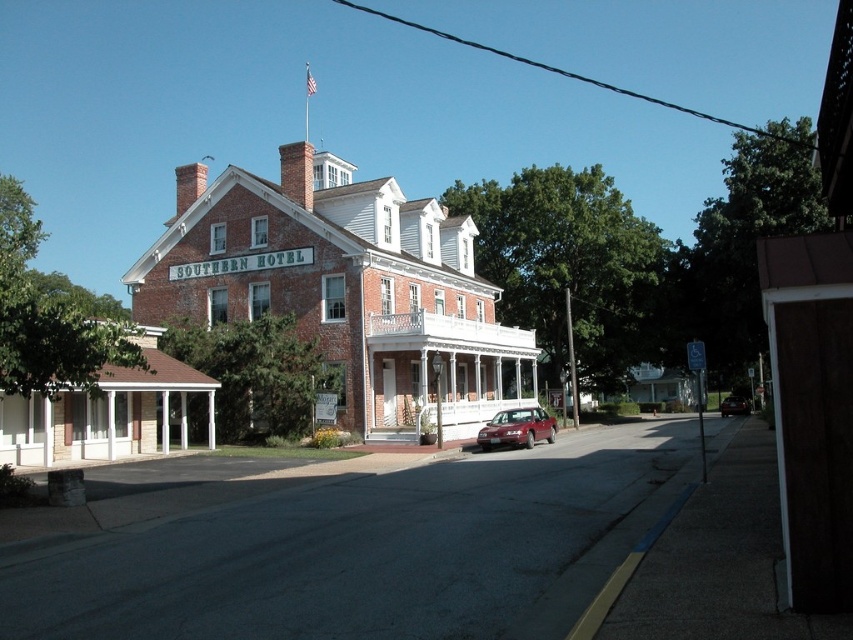
In the scene shown: You are a delivery driver who needs to park your 10 meter long truck between the shiny maroon sedan at center and the shiny red sedan at center. Can you fit your truck in the space between them?

The distance between the shiny maroon sedan at center and the shiny red sedan at center is 32.69 meters. Since your truck is only 10 meters long, there is more than enough space to park it between them.

You are a guest arriving at the Southern Hotel and need to park your 1.8 meters tall motorcycle. The motorcycle requires a parking spot that is at least as tall as the motorcycle. Can the shiny red sedan at center and the white wooden porch at center provide a suitable parking spot based on their heights?

The white wooden porch at center has a greater height compared to the shiny red sedan at center. Since the motorcycle requires a parking spot at least 1.8 meters tall, the white wooden porch at center may be suitable if its height meets or exceeds 1.8 meters. However, the shiny red sedan at center is shorter and likely cannot accommodate the motorcycle.

You are a guest arriving at the Southern Hotel and need to park your car, which is the same size as the shiny maroon sedan at center. There is a parking spot available right next to the white wooden porch at center. Will your car fit in the parking spot without overlapping the porch?

The white wooden porch at center is bigger than the shiny maroon sedan at center, so the parking spot next to it should be large enough to accommodate your car without overlapping the porch.